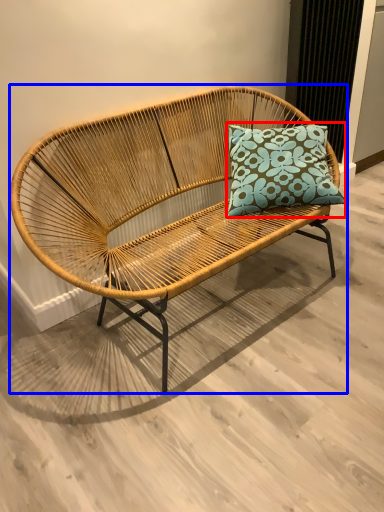
Question: Which object appears farthest to the camera in this image, pillow (highlighted by a red box) or studio couch (highlighted by a blue box)?

Choices:
 (A) pillow
 (B) studio couch

Answer: (A)